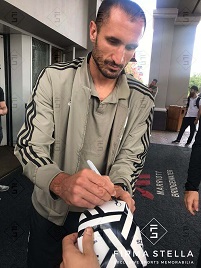
The height and width of the screenshot is (268, 201). What are the coordinates of `"sports memorabilia"` in the screenshot? It's located at (149, 262), (174, 260).